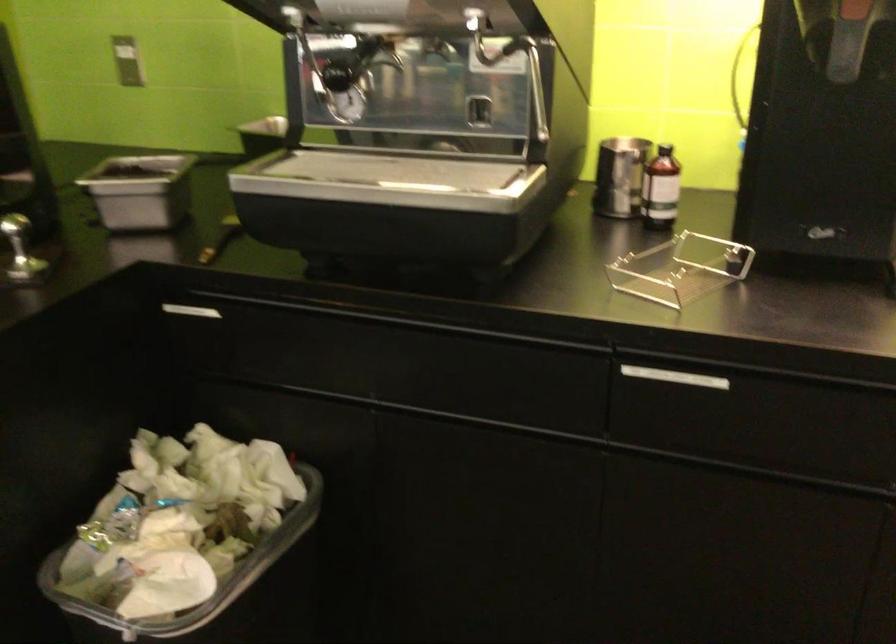
Where would you lift the metal pitcher? Please return your answer as a coordinate pair (x, y).

(619, 176)